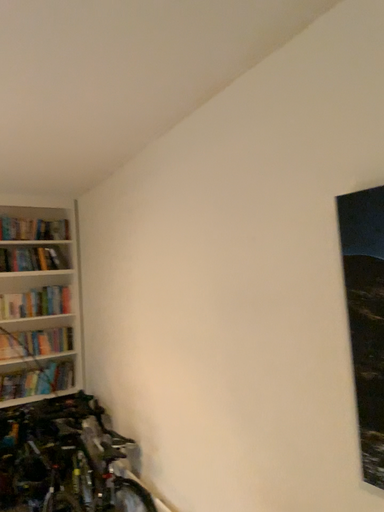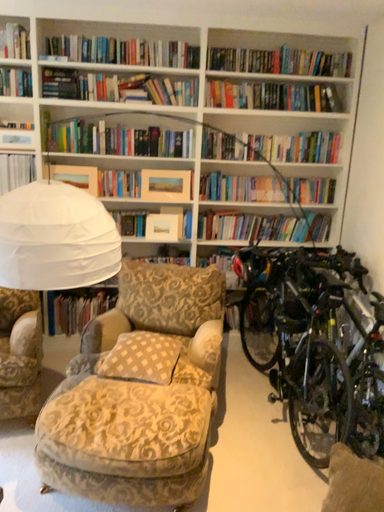
Question: Which way did the camera rotate in the video?

Choices:
 (A) rotated upward
 (B) rotated downward

Answer: (B)